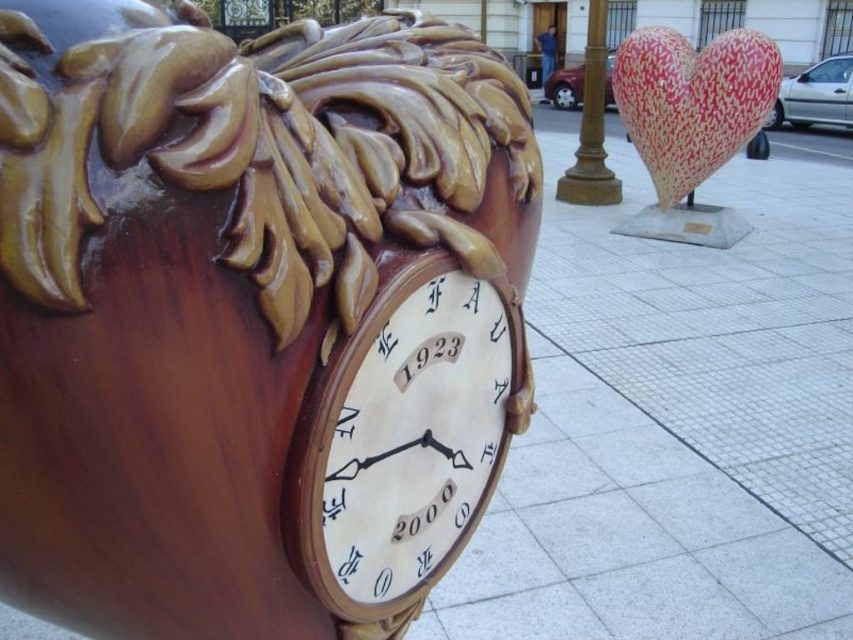
Is white tile pavement at center above red textured heart at upper right?

No.

Can you confirm if white tile pavement at center is smaller than red textured heart at upper right?

Indeed, white tile pavement at center has a smaller size compared to red textured heart at upper right.

Who is more distant from viewer, (788, 579) or (740, 67)?

Positioned behind is point (740, 67).

Image resolution: width=853 pixels, height=640 pixels. Find the location of `white tile pavement at center`. white tile pavement at center is located at coordinates (676, 424).

Is white tile pavement at center smaller than matte brown clock at center?

Yes.

Does white tile pavement at center have a larger size compared to matte brown clock at center?

Incorrect, white tile pavement at center is not larger than matte brown clock at center.

Image resolution: width=853 pixels, height=640 pixels. In order to click on white tile pavement at center in this screenshot , I will do `click(676, 424)`.

Who is positioned more to the right, polished wood clock at center or gold metallic pole at center?

From the viewer's perspective, gold metallic pole at center appears more on the right side.

Is polished wood clock at center above gold metallic pole at center?

No, polished wood clock at center is not above gold metallic pole at center.

What do you see at coordinates (253, 316) in the screenshot? This screenshot has height=640, width=853. I see `polished wood clock at center` at bounding box center [253, 316].

Where is `polished wood clock at center`? This screenshot has width=853, height=640. polished wood clock at center is located at coordinates (253, 316).